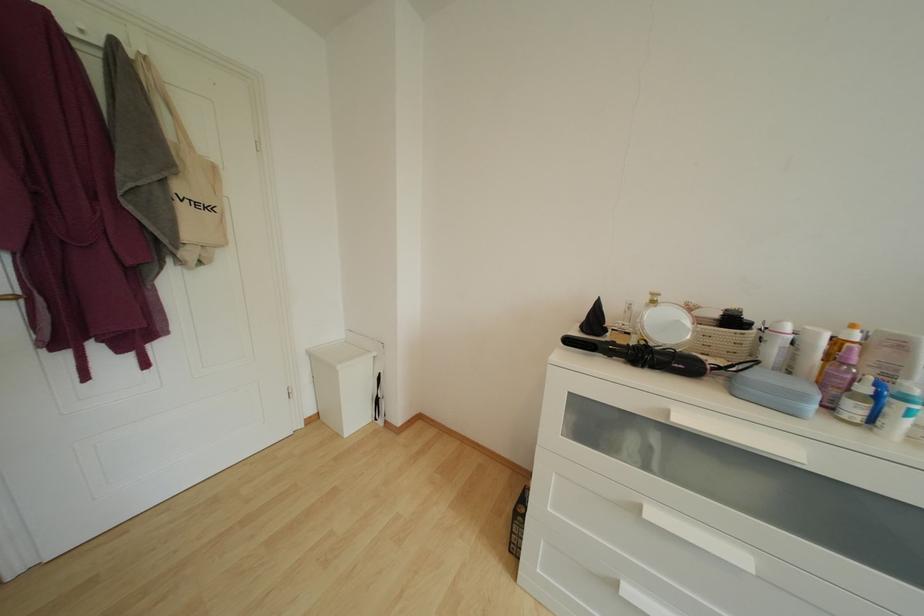
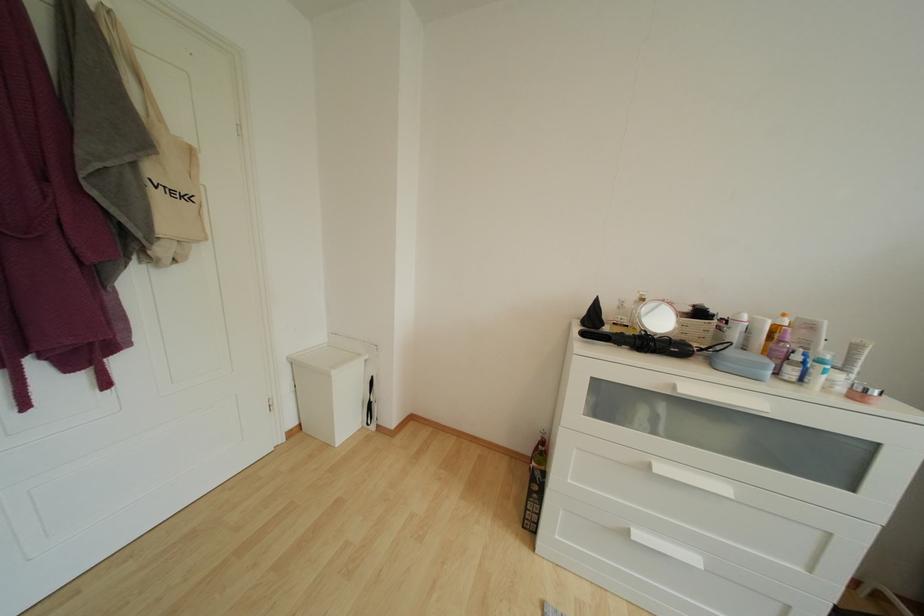
Find the pixel in the second image that matches the point at 650,521 in the first image.

(660, 475)